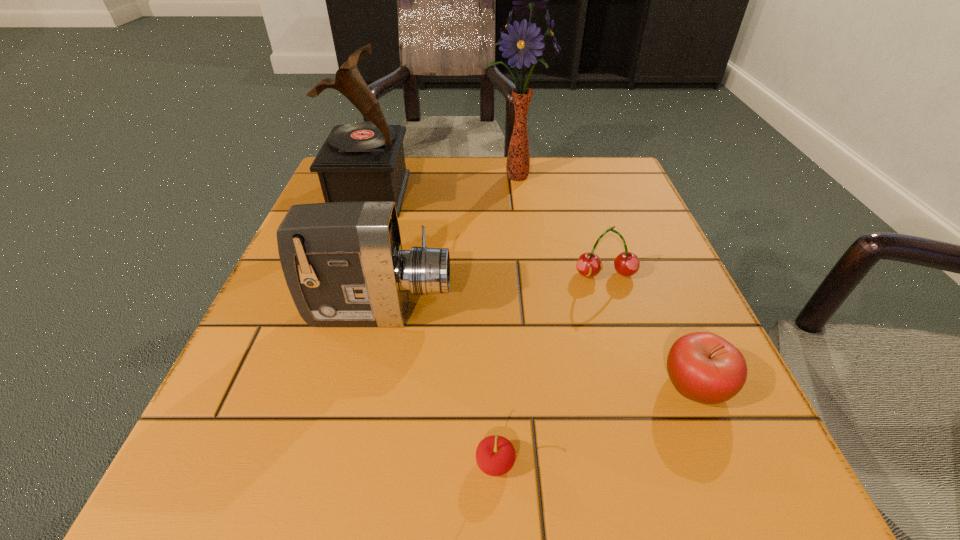
Locate an element on the screen. Image resolution: width=960 pixels, height=540 pixels. empty space that is in between the second nearest object and the tallest object is located at coordinates (605, 280).

Image resolution: width=960 pixels, height=540 pixels. I want to click on vacant point located between the third tallest object and the tallest object, so click(x=447, y=244).

Find the location of a particular element. This screenshot has width=960, height=540. free spot between the right cherry and the second nearest object is located at coordinates (651, 330).

Find the location of a particular element. The width and height of the screenshot is (960, 540). free space that is in between the flower arrangement and the right cherry is located at coordinates (561, 225).

Find the location of a particular element. The height and width of the screenshot is (540, 960). free space between the apple and the fourth farthest object is located at coordinates (538, 349).

Where is `object that is the third closest one to the apple`? object that is the third closest one to the apple is located at coordinates (343, 262).

The image size is (960, 540). Find the location of `object that stands as the closest to the fourth nearest object`. object that stands as the closest to the fourth nearest object is located at coordinates (703, 367).

The image size is (960, 540). In order to click on vacant space that satisfies the following two spatial constraints: 1. at the horn opening of the phonograph_record; 2. on the back side of the nearest object in this screenshot , I will do `click(276, 464)`.

The width and height of the screenshot is (960, 540). Identify the location of vacant space that satisfies the following two spatial constraints: 1. at the front of the third tallest object, highlighting the lens; 2. on the right side of the nearest object. (344, 464).

The height and width of the screenshot is (540, 960). In order to click on vacant point that satisfies the following two spatial constraints: 1. at the front of the fifth farthest object, highlighting the lens; 2. on the right side of the third nearest object in this screenshot , I will do `click(362, 386)`.